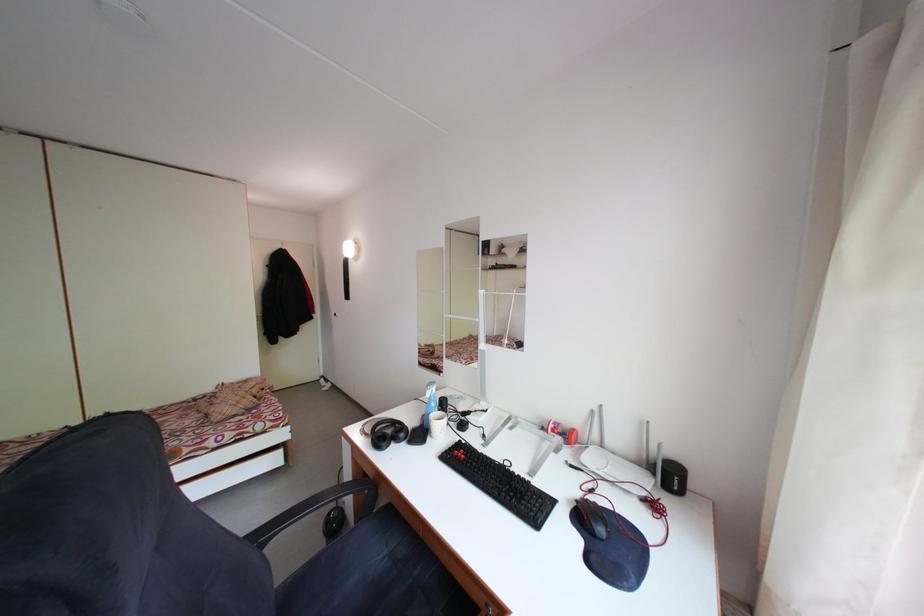
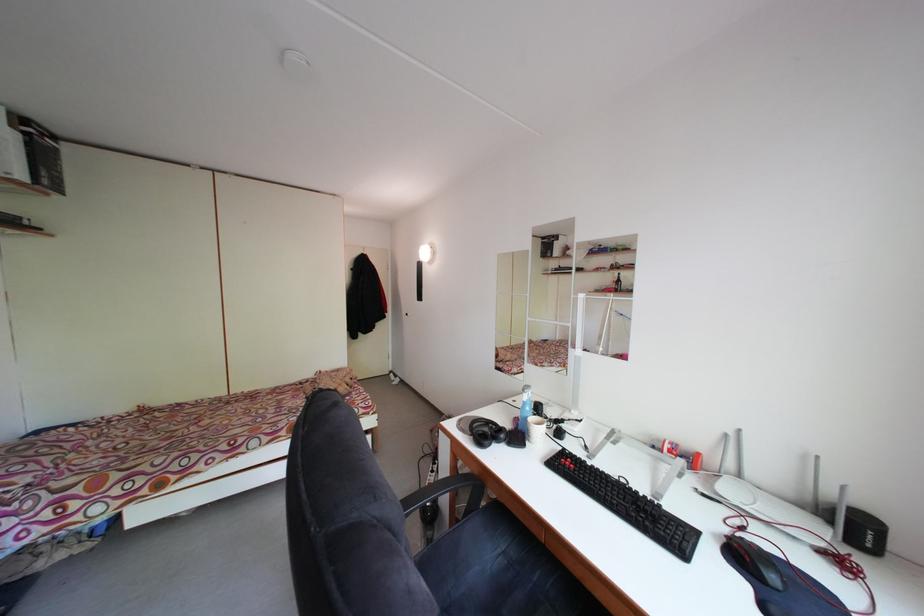
Find the pixel in the second image that matches the point at 432,422 in the first image.

(524, 426)